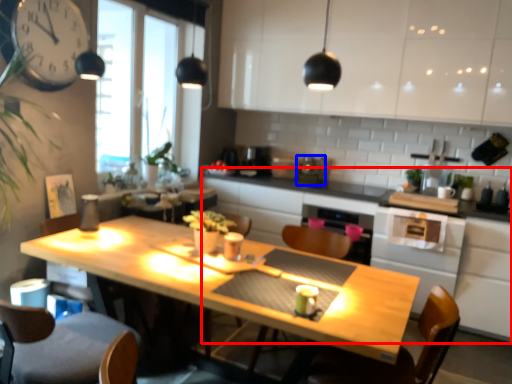
Question: Which point is further to the camera, counter (highlighted by a red box) or appliance (highlighted by a blue box)?

Choices:
 (A) counter
 (B) appliance

Answer: (B)